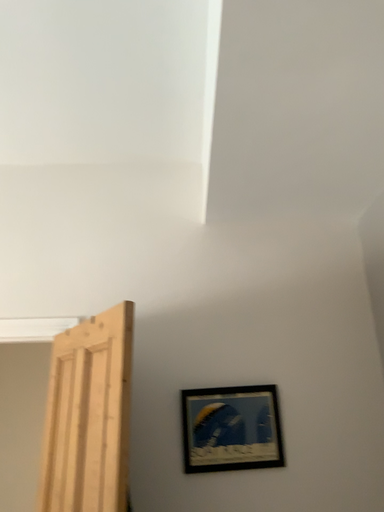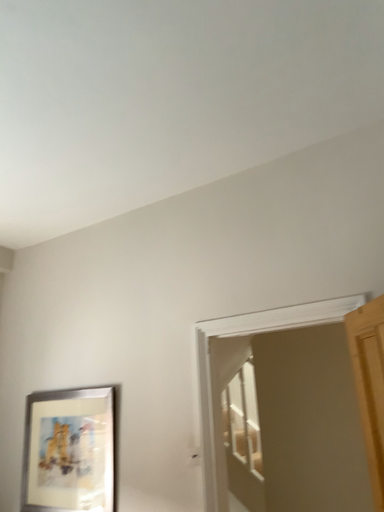
Question: Which way did the camera rotate in the video?

Choices:
 (A) rotated downward
 (B) rotated upward

Answer: (A)